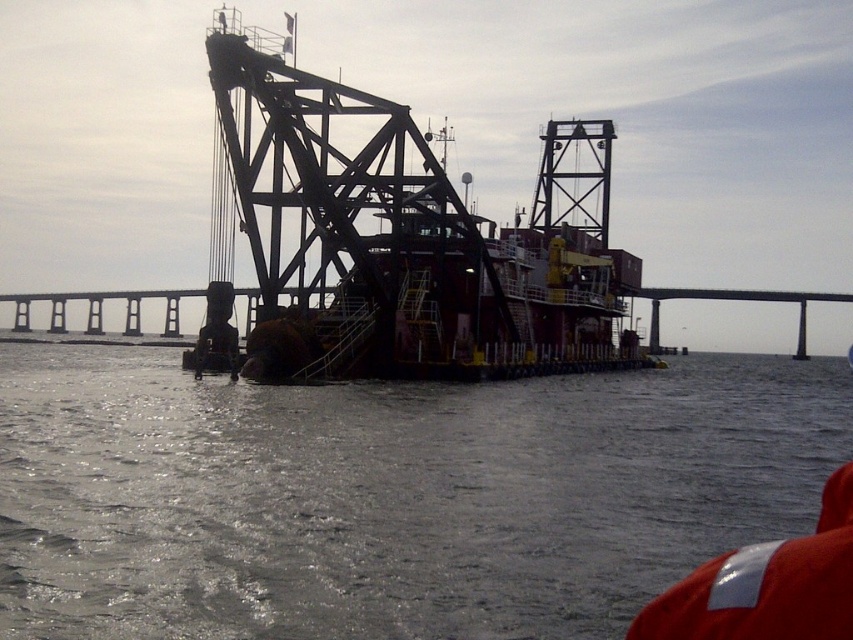
Looking at this image, does gray matte water at center appear over metallic structure at center?

No.

Does gray matte water at center have a greater height compared to metallic structure at center?

In fact, gray matte water at center may be shorter than metallic structure at center.

In order to click on gray matte water at center in this screenshot , I will do `click(389, 496)`.

Is metallic structure at center thinner than concrete bridge at center?

Correct, metallic structure at center's width is less than concrete bridge at center's.

Does metallic structure at center appear on the right side of concrete bridge at center?

In fact, metallic structure at center is to the left of concrete bridge at center.

You are a GUI agent. You are given a task and a screenshot of the screen. Output one action in this format:
    pyautogui.click(x=<x>, y=<y>)
    Task: Click on the metallic structure at center
    Image resolution: width=853 pixels, height=640 pixels.
    Given the screenshot: What is the action you would take?
    (x=397, y=240)

You are a GUI agent. You are given a task and a screenshot of the screen. Output one action in this format:
    pyautogui.click(x=<x>, y=<y>)
    Task: Click on the metallic structure at center
    The height and width of the screenshot is (640, 853).
    Given the screenshot: What is the action you would take?
    pyautogui.click(x=397, y=240)

Can you confirm if gray matte water at center is positioned to the left of concrete bridge at center?

Incorrect, gray matte water at center is not on the left side of concrete bridge at center.

Find the location of a particular element. gray matte water at center is located at coordinates (389, 496).

Between point (160, 416) and point (846, 296), which one is positioned in front?

Point (160, 416)

Where is `gray matte water at center`? This screenshot has width=853, height=640. gray matte water at center is located at coordinates (389, 496).